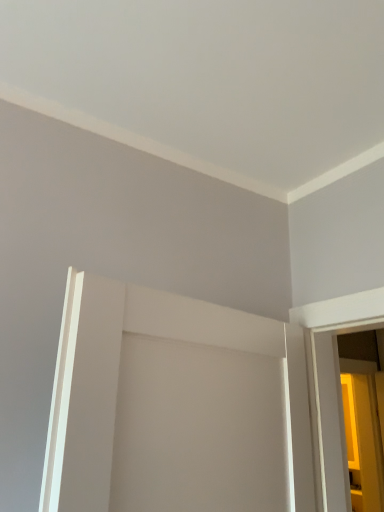
Measure the distance between point [367,326] and camera.

The distance of point [367,326] from camera is 4.23 feet.

The image size is (384, 512). Describe the element at coordinates (331, 415) in the screenshot. I see `translucent glass screen door at right` at that location.

The width and height of the screenshot is (384, 512). In order to click on translucent glass screen door at right in this screenshot , I will do `click(331, 415)`.

This screenshot has height=512, width=384. What are the coordinates of `translucent glass screen door at right` in the screenshot? It's located at (331, 415).